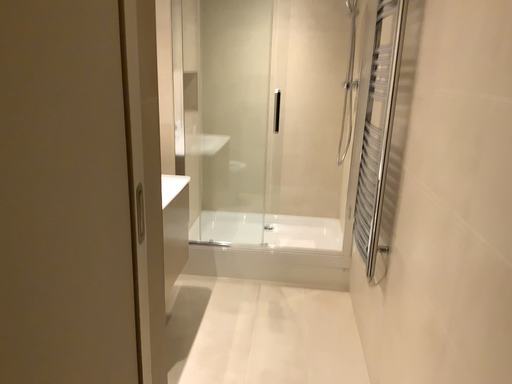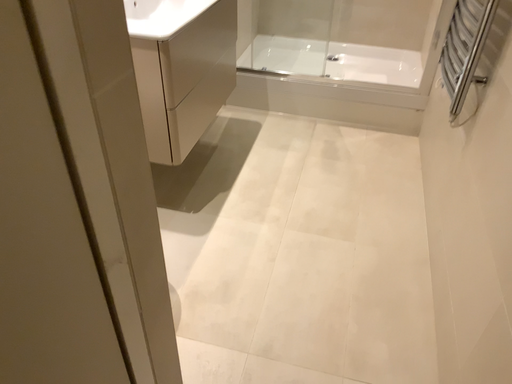
Question: How did the camera likely rotate when shooting the video?

Choices:
 (A) rotated downward
 (B) rotated upward

Answer: (A)